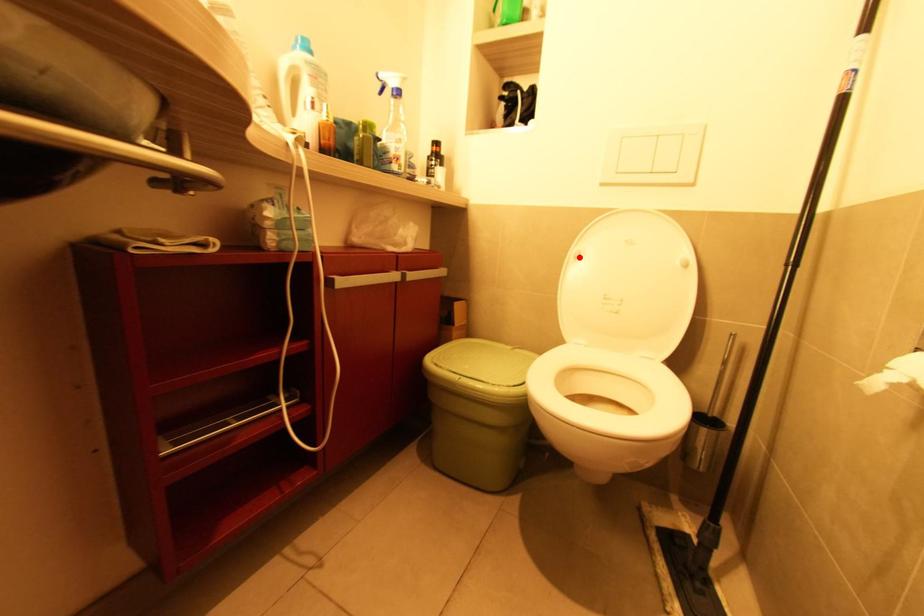
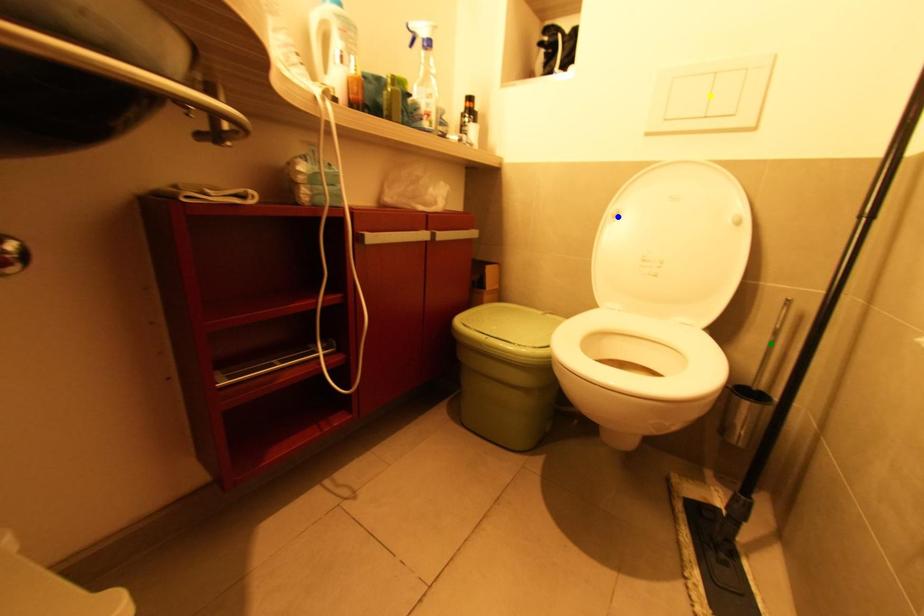
Question: I am providing you with two images of the same scene from different viewpoints. A red point is marked on the first image. You are given multiple points on the second image. Which point in image 2 represents the same 3d spot as the red point in image 1?

Choices:
 (A) blue point
 (B) yellow point
 (C) green point

Answer: (A)